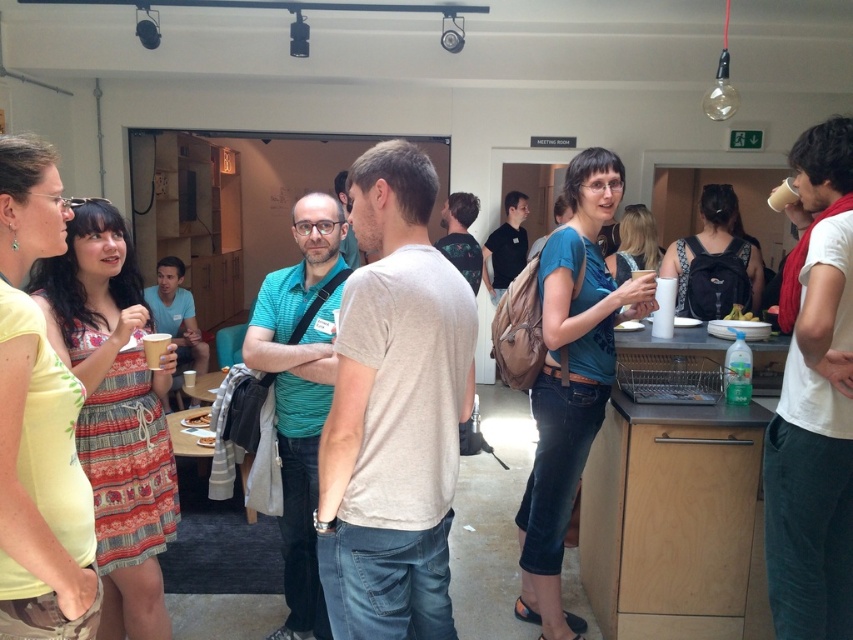
From the picture: You are organizing a photo shoot and need to ensure that the matte blue shirt at center and the green matte broccoli at right are both visible in the frame. Based on their sizes, which object should you prioritize positioning closer to the camera to ensure visibility?

The matte blue shirt at center might be wider than green matte broccoli at right, so you should prioritize positioning the green matte broccoli at right closer to the camera to ensure visibility.

You are standing at the entrance of the room and want to take a photo of the two points mentioned. Which point, point (575, 243) or point (741, 307), will appear larger in the photo?

Point (575, 243) is closer to the camera than point (741, 307), so it will appear larger in the photo.